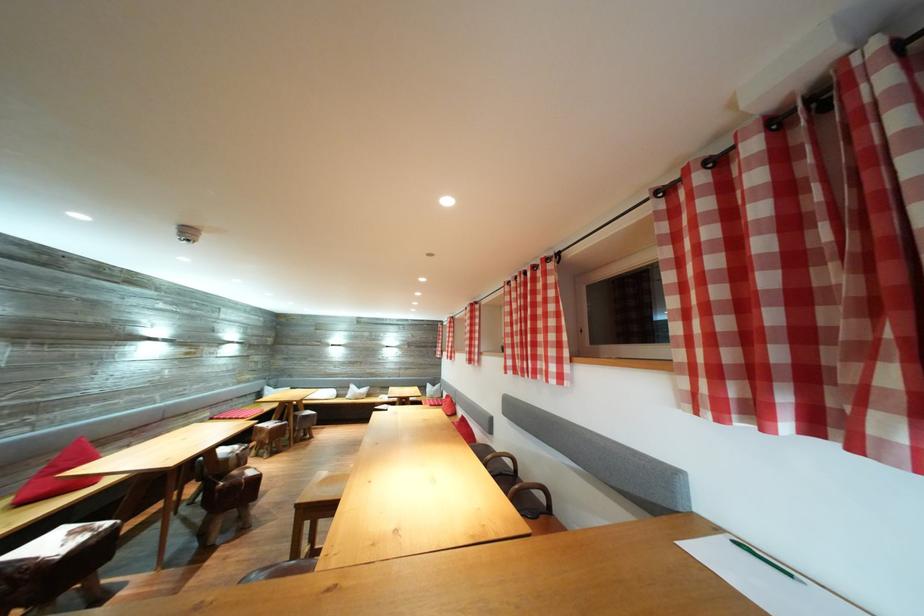
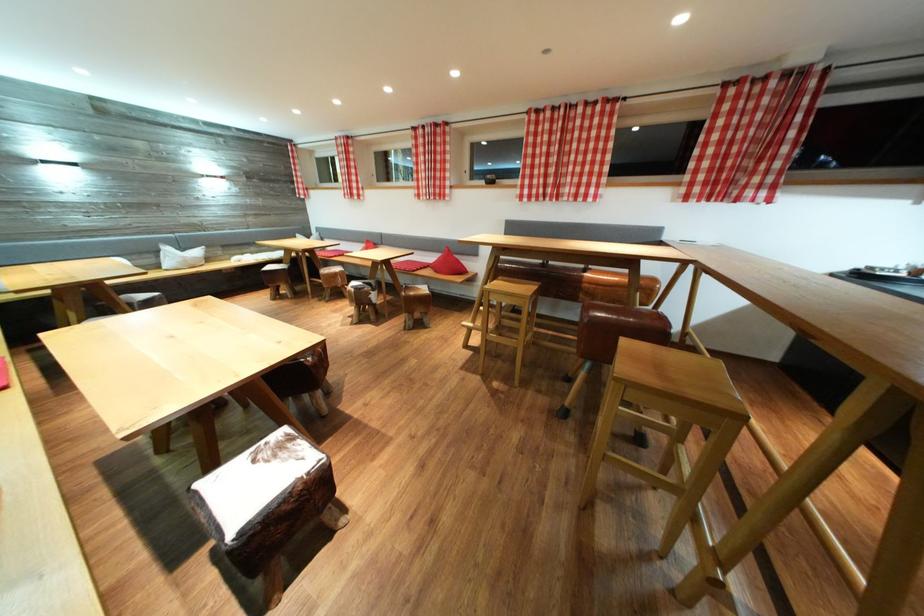
Question: I am providing you with two images of the same scene from different viewpoints. Please identify which objects are invisible in image2.

Choices:
 (A) white pillow bag
 (B) dark grey mug
 (C) chair sitting surface
 (D) brown leather stool

Answer: (C)